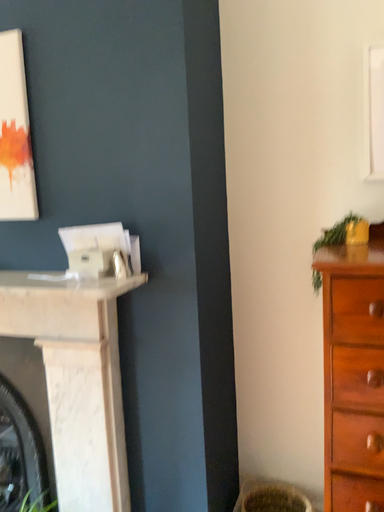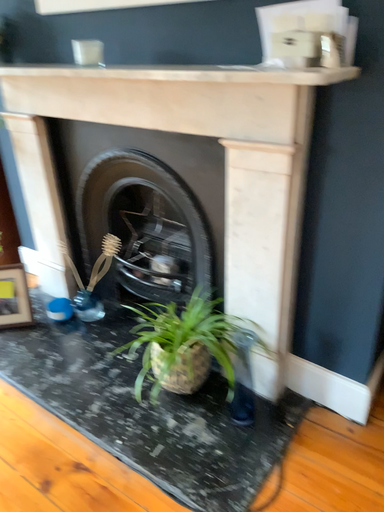
Question: How did the camera likely rotate when shooting the video?

Choices:
 (A) rotated right
 (B) rotated left

Answer: (B)